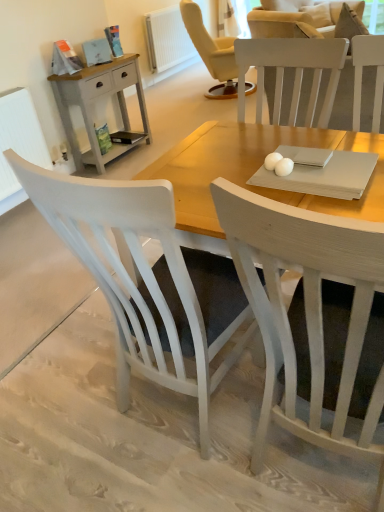
Question: From the image's perspective, is matte gray wooden nightstand at left on top of white painted radiator at upper center, positioned as the 1th radiator in back-to-front order?

Choices:
 (A) yes
 (B) no

Answer: (B)

Question: Does matte gray wooden nightstand at left have a larger size compared to white painted radiator at upper center, the 2th radiator viewed from the front?

Choices:
 (A) yes
 (B) no

Answer: (B)

Question: Can you confirm if matte gray wooden nightstand at left is positioned to the right of white painted radiator at upper center, which is the second radiator from left to right?

Choices:
 (A) yes
 (B) no

Answer: (B)

Question: Is matte gray wooden nightstand at left directly adjacent to white painted radiator at upper center, positioned as the 1th radiator in back-to-front order?

Choices:
 (A) no
 (B) yes

Answer: (A)

Question: From a real-world perspective, is matte gray wooden nightstand at left physically below white painted radiator at upper center, the 1th radiator in the top-to-bottom sequence?

Choices:
 (A) no
 (B) yes

Answer: (B)

Question: Is matte gray wooden nightstand at left in front of or behind white wood chair at center, which is the first chair from right to left, in the image?

Choices:
 (A) front
 (B) behind

Answer: (B)

Question: From a real-world perspective, relative to white wood chair at center, which appears as the second chair when viewed from the left, is matte gray wooden nightstand at left vertically above or below?

Choices:
 (A) below
 (B) above

Answer: (A)

Question: Is matte gray wooden nightstand at left bigger or smaller than white wood chair at center, which is the first chair from right to left?

Choices:
 (A) big
 (B) small

Answer: (B)

Question: Do you think matte gray wooden nightstand at left is within white wood chair at center, which is the first chair from right to left, or outside of it?

Choices:
 (A) outside
 (B) inside

Answer: (A)

Question: Is white textured radiator at left, the 2th radiator when ordered from right to left, in front of or behind matte gray wooden nightstand at left in the image?

Choices:
 (A) front
 (B) behind

Answer: (A)

Question: From a real-world perspective, relative to matte gray wooden nightstand at left, is white textured radiator at left, the 2th radiator from the top, vertically above or below?

Choices:
 (A) above
 (B) below

Answer: (A)

Question: Considering the positions of white textured radiator at left, the 2th radiator from the top, and matte gray wooden nightstand at left in the image, is white textured radiator at left, the 2th radiator from the top, bigger or smaller than matte gray wooden nightstand at left?

Choices:
 (A) small
 (B) big

Answer: (A)

Question: From the image's perspective, relative to matte gray wooden nightstand at left, is white textured radiator at left, which is the first radiator in front-to-back order, above or below?

Choices:
 (A) below
 (B) above

Answer: (A)

Question: Considering their positions, is matte gray wooden nightstand at left located in front of or behind white wood chair at center, which is the 2th chair in right-to-left order?

Choices:
 (A) behind
 (B) front

Answer: (A)

Question: Is point (130, 144) closer or farther from the camera than point (38, 172)?

Choices:
 (A) closer
 (B) farther

Answer: (B)